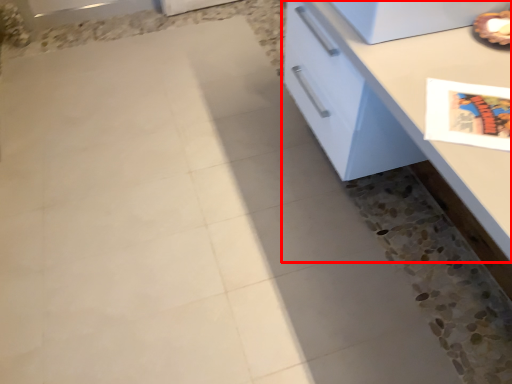
Question: From the image's perspective, where is countertop (annotated by the red box) located relative to appliance?

Choices:
 (A) above
 (B) below

Answer: (B)